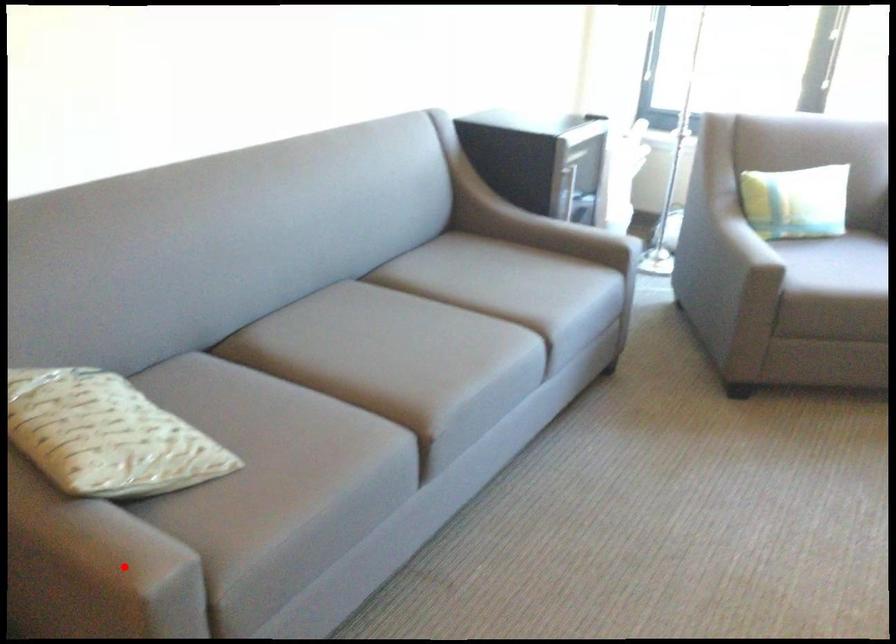
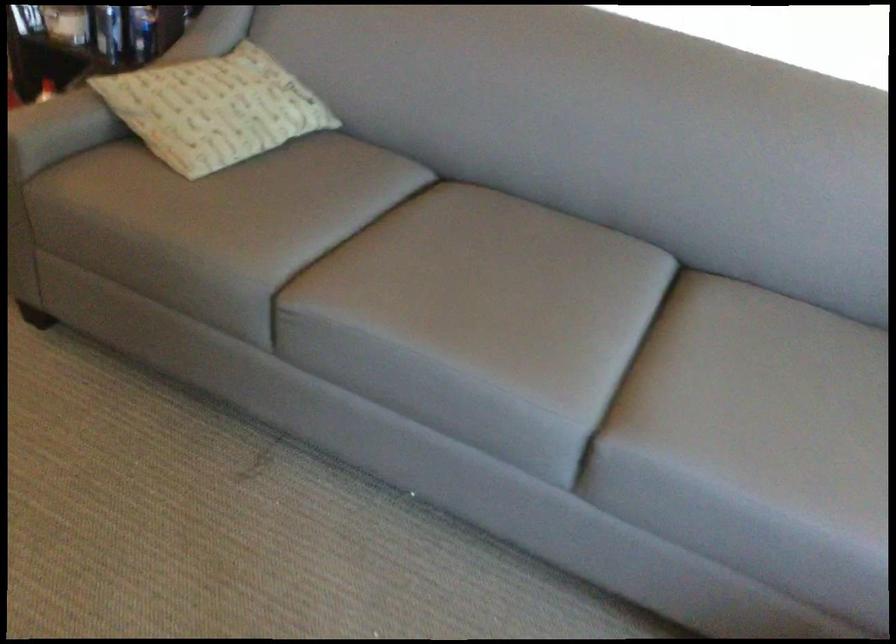
Where in the second image is the point corresponding to the highlighted location from the first image?

(32, 125)